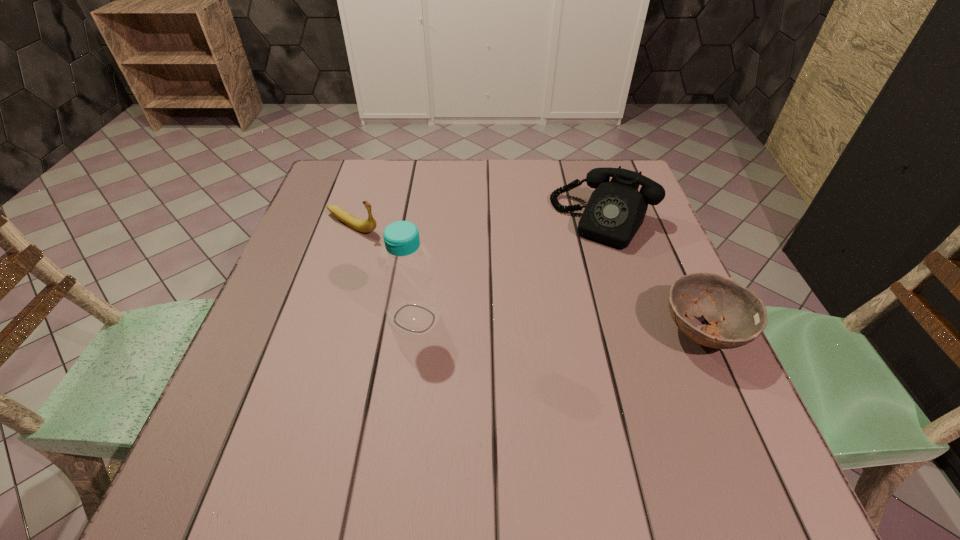
Where is `free point between the bottle and the shortest object`? The width and height of the screenshot is (960, 540). free point between the bottle and the shortest object is located at coordinates (559, 325).

Identify the location of vacant space that's between the bowl and the telephone. (654, 276).

Image resolution: width=960 pixels, height=540 pixels. In order to click on object that stands as the second closest to the leftmost object in this screenshot , I will do `click(615, 211)`.

At what (x,y) coordinates should I click in order to perform the action: click on object that can be found as the closest to the bowl. Please return your answer as a coordinate pair (x, y). This screenshot has width=960, height=540. Looking at the image, I should click on (615, 211).

Find the location of a particular element. This screenshot has height=540, width=960. free spot that satisfies the following two spatial constraints: 1. on the front side of the third tallest object; 2. on the right side of the shortest object is located at coordinates (318, 332).

Where is `vacant point that satisfies the following two spatial constraints: 1. on the back side of the tallest object; 2. on the left side of the telephone`? The width and height of the screenshot is (960, 540). vacant point that satisfies the following two spatial constraints: 1. on the back side of the tallest object; 2. on the left side of the telephone is located at coordinates tap(427, 221).

Where is `free space that satisfies the following two spatial constraints: 1. on the front side of the banana; 2. on the left side of the bowl`? free space that satisfies the following two spatial constraints: 1. on the front side of the banana; 2. on the left side of the bowl is located at coordinates (318, 332).